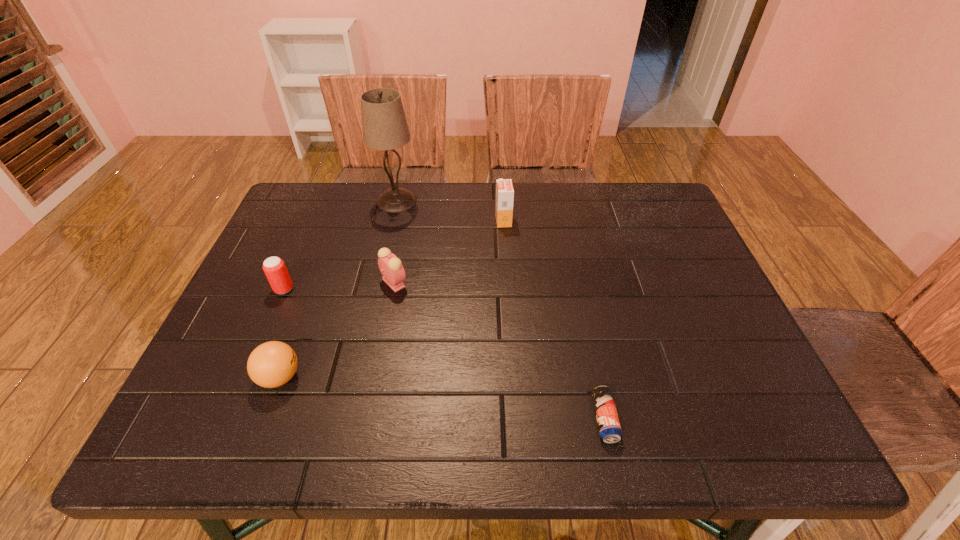
The image size is (960, 540). Identify the location of free region located on the front-facing side of the tallest object. (383, 262).

At what (x,y) coordinates should I click in order to perform the action: click on free space located 0.380m on the left of the fifth nearest object. Please return your answer as a coordinate pair (x, y). Image resolution: width=960 pixels, height=540 pixels. Looking at the image, I should click on (363, 221).

Where is `vacant space situated on the face of the alarm clock`? vacant space situated on the face of the alarm clock is located at coordinates (518, 283).

The height and width of the screenshot is (540, 960). I want to click on free spot located on the front of the farther beer can, so click(218, 442).

Where is `vacant space positioned 0.360m on the side with brand of the ping-pong ball`? vacant space positioned 0.360m on the side with brand of the ping-pong ball is located at coordinates (478, 377).

Locate an element on the screen. vacant region located on the back of the right beer can is located at coordinates (581, 307).

The image size is (960, 540). Find the location of `lampshade that is at the far edge`. lampshade that is at the far edge is located at coordinates (384, 123).

Where is `orange juice that is at the far edge`? The image size is (960, 540). orange juice that is at the far edge is located at coordinates (504, 188).

Where is `object situated at the near edge`? This screenshot has width=960, height=540. object situated at the near edge is located at coordinates (609, 427).

Locate an element on the screen. This screenshot has height=540, width=960. beer can present at the left edge is located at coordinates (274, 267).